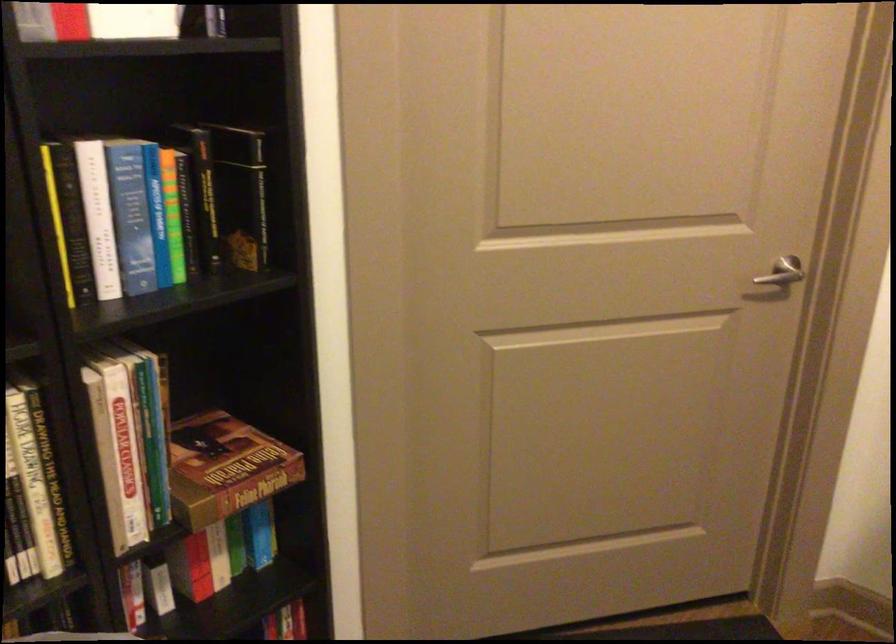
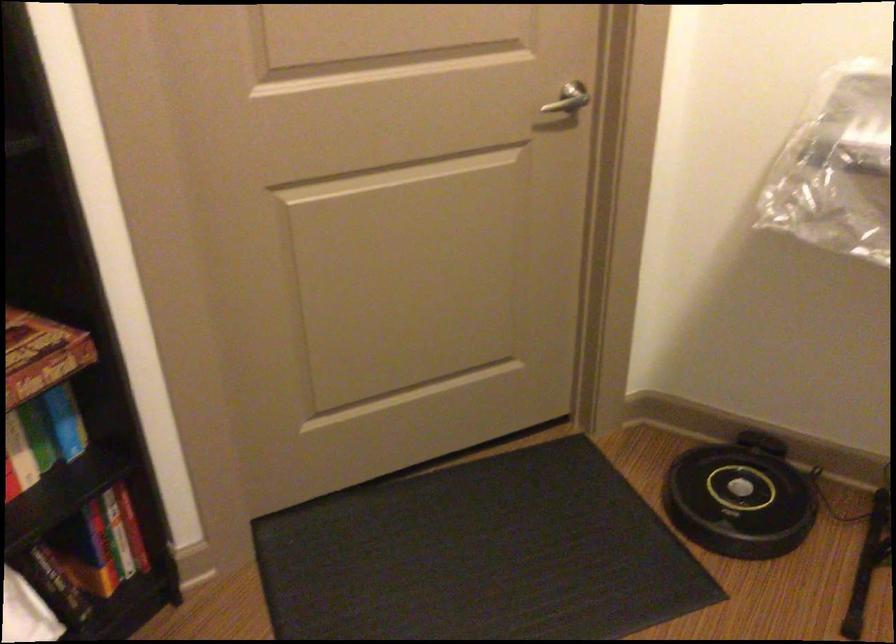
Question: In a continuous first-person perspective shot, in which direction is the camera moving?

Choices:
 (A) Left
 (B) Right
 (C) Forward
 (D) Backward

Answer: (B)